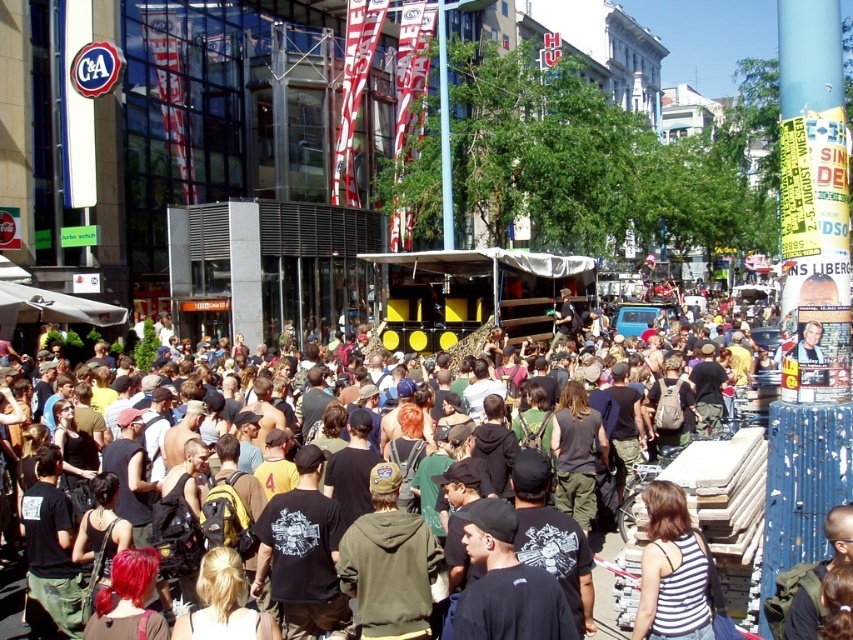
Between white striped tank top at lower center and dark green backpack at center, which one has more height?

Standing taller between the two is dark green backpack at center.

Find the location of a particular element. This screenshot has width=853, height=640. white striped tank top at lower center is located at coordinates (671, 570).

Which is more to the right, green hoodie at center or black cotton crowd at center?

From the viewer's perspective, black cotton crowd at center appears more on the right side.

Who is taller, green hoodie at center or black cotton crowd at center?

black cotton crowd at center is taller.

This screenshot has width=853, height=640. What do you see at coordinates (389, 563) in the screenshot?
I see `green hoodie at center` at bounding box center [389, 563].

You are a GUI agent. You are given a task and a screenshot of the screen. Output one action in this format:
    pyautogui.click(x=<x>, y=<y>)
    Task: Click on the green hoodie at center
    The image size is (853, 640).
    Given the screenshot: What is the action you would take?
    pyautogui.click(x=389, y=563)

Is green hoodie at center shorter than white striped tank top at lower center?

Indeed, green hoodie at center has a lesser height compared to white striped tank top at lower center.

Who is taller, green hoodie at center or white striped tank top at lower center?

white striped tank top at lower center

Is point (381, 570) positioned after point (672, 524)?

Yes, it is behind point (672, 524).

Find the location of a particular element. The width and height of the screenshot is (853, 640). green hoodie at center is located at coordinates (389, 563).